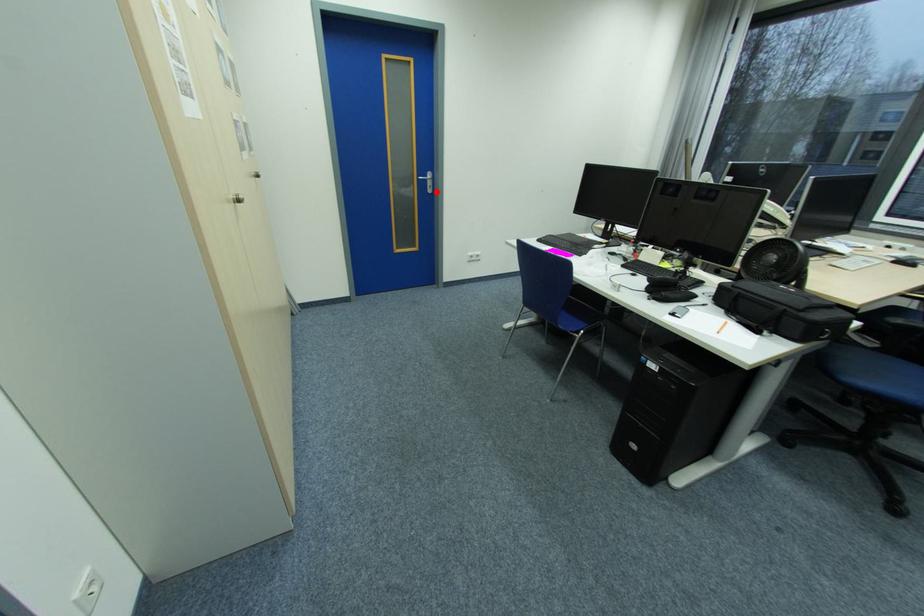
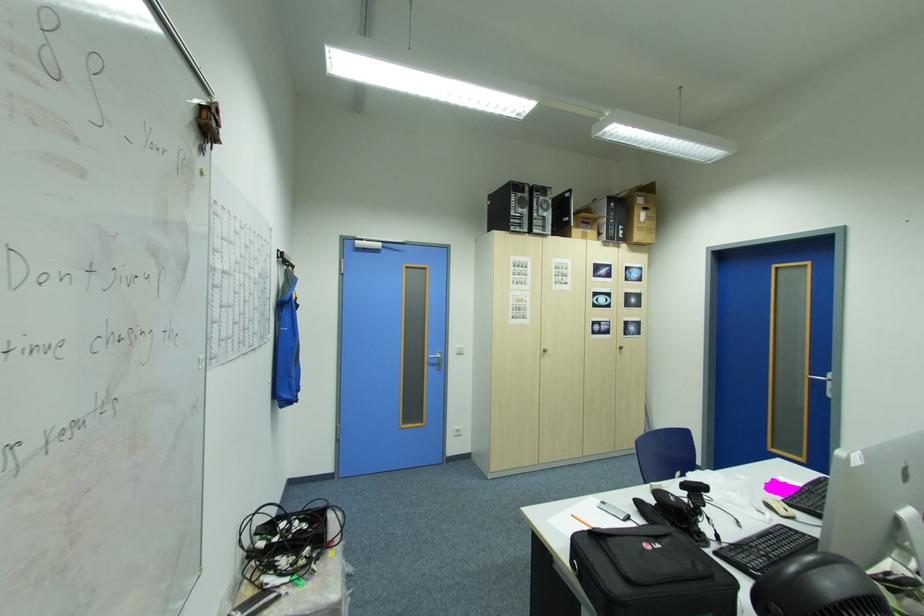
Question: I am providing you with two images of the same scene from different viewpoints. In image1, a red point is highlighted. Considering the same 3D point in image2, which of the following is correct?

Choices:
 (A) It is closer
 (B) It is farther

Answer: (B)